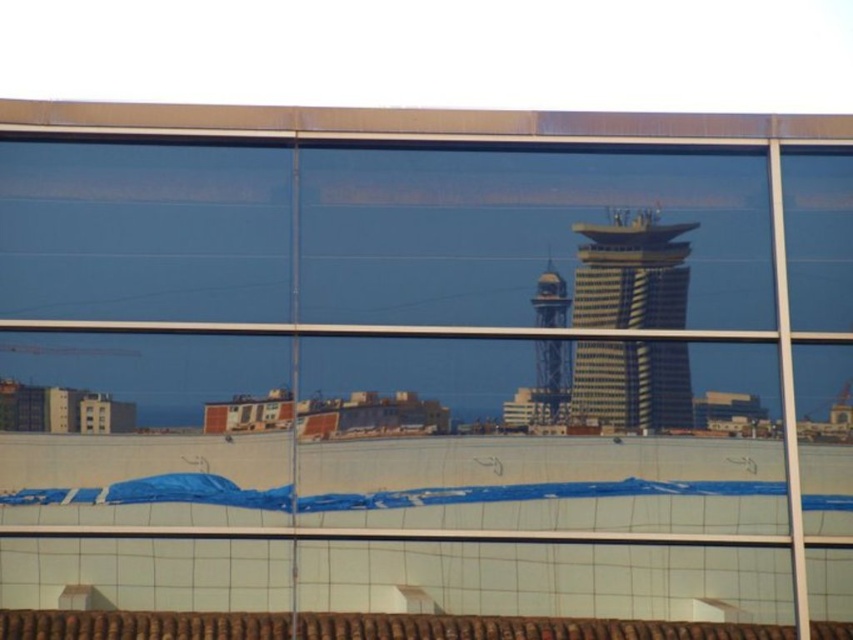
Which is in front, point (640, 403) or point (561, 301)?

Point (640, 403) is more forward.

At what (x,y) coordinates should I click in order to perform the action: click on smooth glass tower at center. Please return your answer as a coordinate pair (x, y). Looking at the image, I should click on (631, 273).

Is point (645, 397) positioned after point (555, 362)?

No, (645, 397) is in front of (555, 362).

Image resolution: width=853 pixels, height=640 pixels. I want to click on smooth glass tower at center, so click(x=631, y=273).